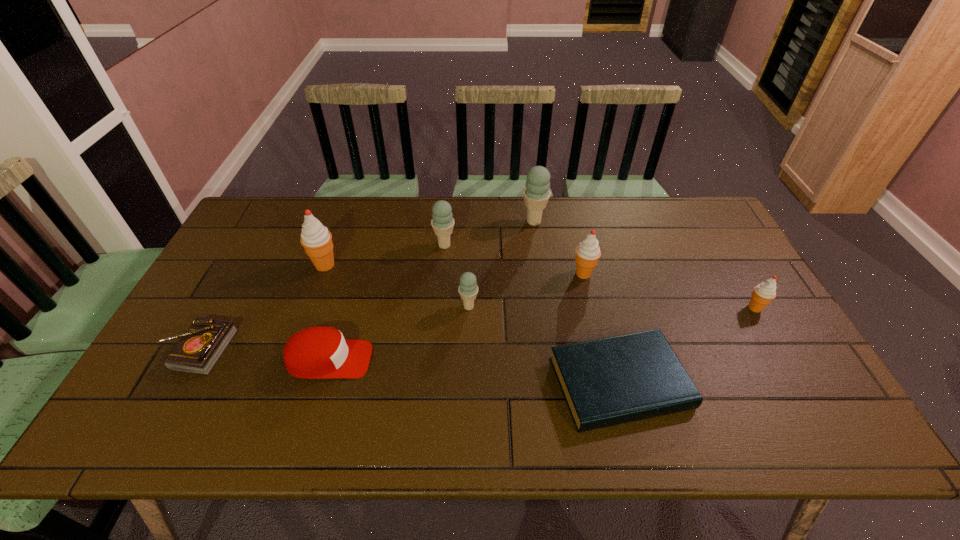
What are the coordinates of `the biggest blue ice cream` in the screenshot? It's located at (536, 194).

Identify the location of the farthest ice cream. Image resolution: width=960 pixels, height=540 pixels. (536, 194).

Locate an element on the screen. the leftmost red icecream is located at coordinates coord(315,238).

Find the location of a particular element. The width and height of the screenshot is (960, 540). the leftmost ice cream is located at coordinates (315, 238).

Where is `the leftmost blue ice cream`? This screenshot has height=540, width=960. the leftmost blue ice cream is located at coordinates (442, 223).

At what (x,y) coordinates should I click in order to perform the action: click on the fourth object from left to right. Please return your answer as a coordinate pair (x, y). Looking at the image, I should click on (442, 223).

Locate an element on the screen. Image resolution: width=960 pixels, height=540 pixels. the second smallest red icecream is located at coordinates (588, 252).

Identify the location of the second red icecream from left to right. (588, 252).

At what (x,y) coordinates should I click in order to perform the action: click on the smallest red icecream. Please return your answer as a coordinate pair (x, y). The image size is (960, 540). Looking at the image, I should click on (765, 292).

This screenshot has height=540, width=960. Identify the location of the rightmost red icecream. (765, 292).